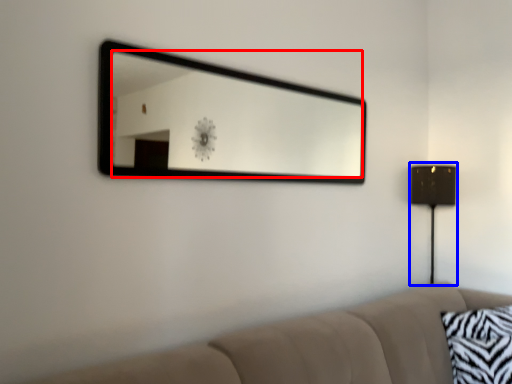
Question: Which object is further to the camera taking this photo, mirror (highlighted by a red box) or table lamp (highlighted by a blue box)?

Choices:
 (A) mirror
 (B) table lamp

Answer: (B)